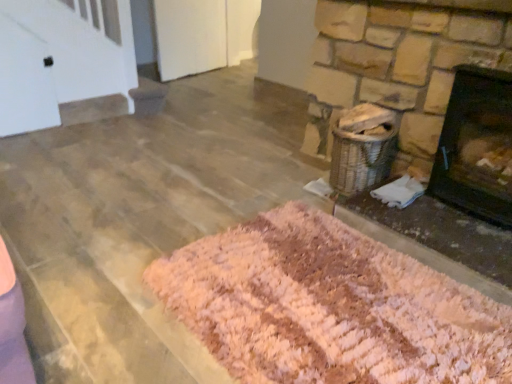
Question: Is pink shag rug at lower right bigger or smaller than black matte fireplace at right?

Choices:
 (A) big
 (B) small

Answer: (B)

Question: Would you say pink shag rug at lower right is to the left or to the right of black matte fireplace at right in the picture?

Choices:
 (A) left
 (B) right

Answer: (A)

Question: Which object is the closest to the black matte fireplace at right?

Choices:
 (A) pink shag rug at lower right
 (B) pink shaggy rug at lower center

Answer: (A)

Question: Estimate the real-world distances between objects in this image. Which object is farther from the black matte fireplace at right?

Choices:
 (A) pink shag rug at lower right
 (B) pink shaggy rug at lower center

Answer: (B)